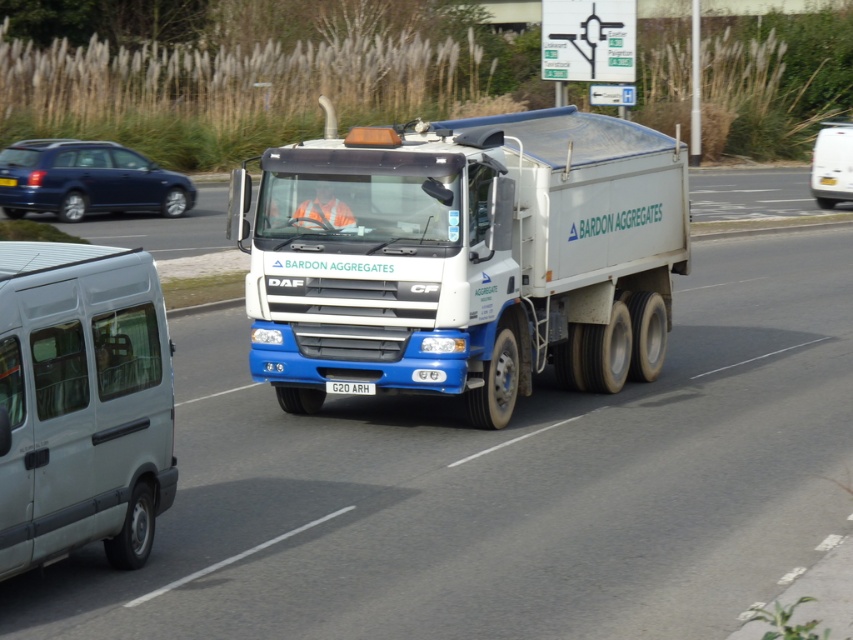
Looking at this image, can you confirm if white matte truck at center is smaller than white plastic license plate at center?

Incorrect, white matte truck at center is not smaller in size than white plastic license plate at center.

Which is behind, point (515, 356) or point (355, 381)?

Point (515, 356)

Locate an element on the screen. white matte truck at center is located at coordinates (463, 257).

Does white matte van at lower left have a smaller size compared to white matte van at right?

Indeed, white matte van at lower left has a smaller size compared to white matte van at right.

Does point (109, 339) come closer to viewer compared to point (834, 179)?

Yes, point (109, 339) is in front of point (834, 179).

Where is `white matte van at lower left`? white matte van at lower left is located at coordinates (80, 403).

Can you confirm if white matte truck at center is bigger than white matte van at right?

Incorrect, white matte truck at center is not larger than white matte van at right.

Is white matte truck at center to the left of white matte van at right from the viewer's perspective?

Correct, you'll find white matte truck at center to the left of white matte van at right.

In order to click on white matte truck at center in this screenshot , I will do `click(463, 257)`.